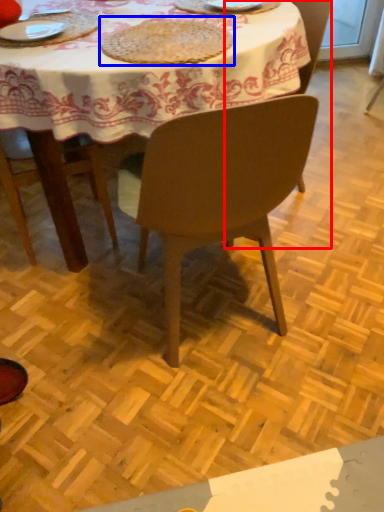
Question: Which point is closer to the camera, chair (highlighted by a red box) or mat (highlighted by a blue box)?

Choices:
 (A) chair
 (B) mat

Answer: (B)